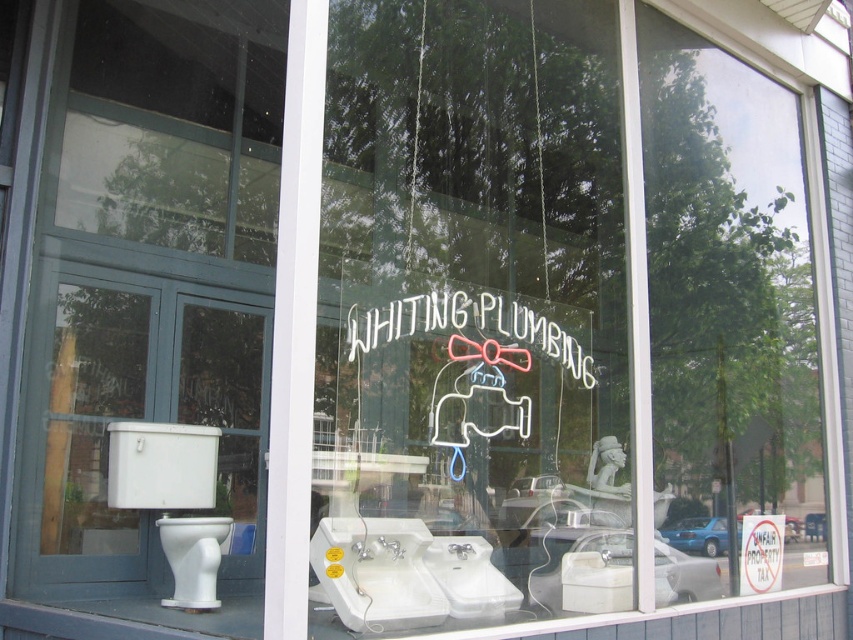
Does neon sign at center have a greater height compared to white paper sign at center?

Indeed, neon sign at center has a greater height compared to white paper sign at center.

Does neon sign at center have a smaller size compared to white paper sign at center?

No, neon sign at center is not smaller than white paper sign at center.

I want to click on neon sign at center, so click(x=467, y=326).

Which is below, white glossy toilet at lower left or neon sign at center?

white glossy toilet at lower left is below.

Between point (167, 504) and point (492, 304), which one is positioned behind?

The point (167, 504) is more distant.

Locate an element on the screen. Image resolution: width=853 pixels, height=640 pixels. white glossy toilet at lower left is located at coordinates (161, 465).

Is the position of white glossy toilet at lower left less distant than that of white glossy toilet bowl at lower left?

No, it is not.

Which is above, white glossy toilet at lower left or white glossy toilet bowl at lower left?

white glossy toilet at lower left is above.

You are a GUI agent. You are given a task and a screenshot of the screen. Output one action in this format:
    pyautogui.click(x=<x>, y=<y>)
    Task: Click on the white glossy toilet at lower left
    The height and width of the screenshot is (640, 853).
    Given the screenshot: What is the action you would take?
    pyautogui.click(x=161, y=465)